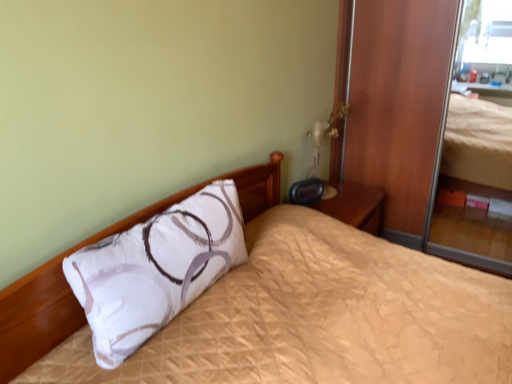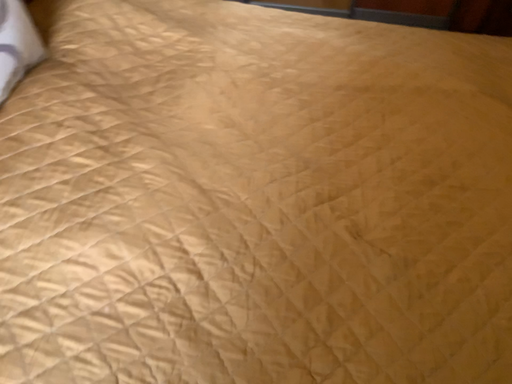
Question: Which way did the camera rotate in the video?

Choices:
 (A) rotated upward
 (B) rotated downward

Answer: (B)